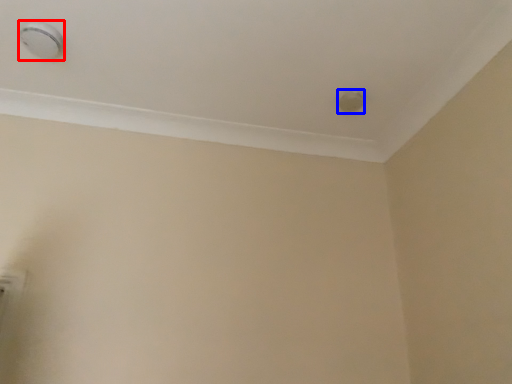
Question: Among these objects, which one is farthest to the camera, knob (highlighted by a red box) or knob (highlighted by a blue box)?

Choices:
 (A) knob
 (B) knob

Answer: (B)